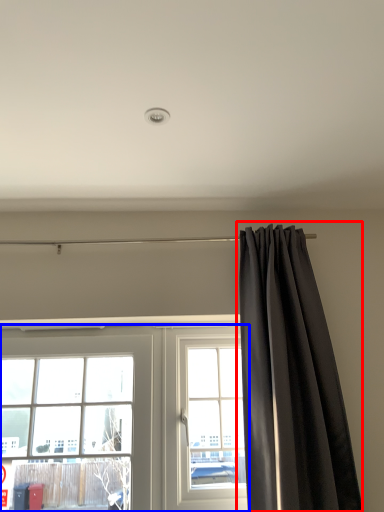
Question: Which point is further to the camera, curtain (highlighted by a red box) or window (highlighted by a blue box)?

Choices:
 (A) curtain
 (B) window

Answer: (B)